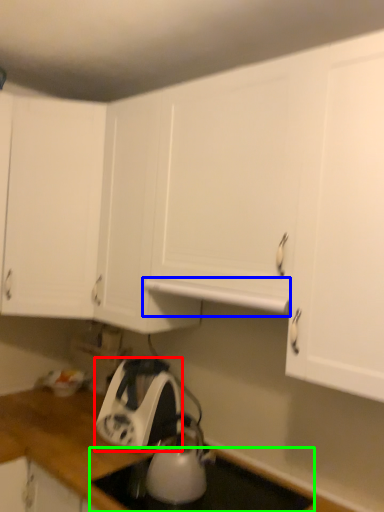
Question: Estimate the real-world distances between objects in this image. Which object is farther from home appliance (highlighted by a red box), exhaust hood (highlighted by a blue box) or gas stove (highlighted by a green box)?

Choices:
 (A) exhaust hood
 (B) gas stove

Answer: (A)